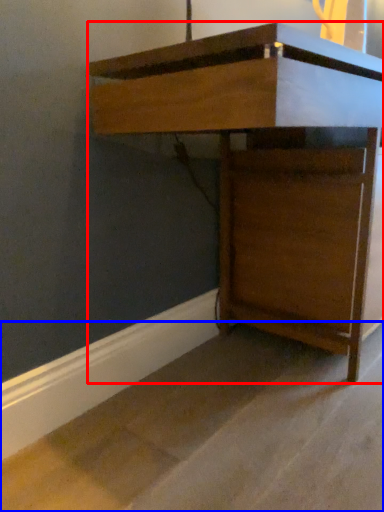
Question: Which object is closer to the camera taking this photo, furniture (highlighted by a red box) or concrete (highlighted by a blue box)?

Choices:
 (A) furniture
 (B) concrete

Answer: (B)